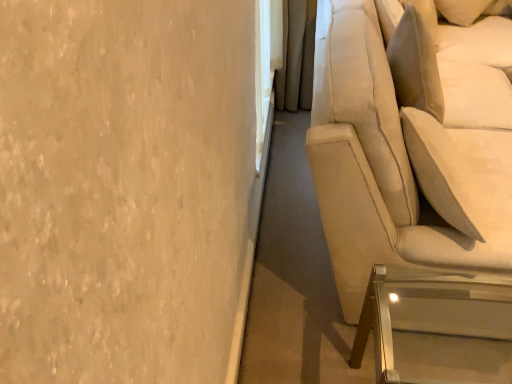
This screenshot has height=384, width=512. What do you see at coordinates (406, 151) in the screenshot?
I see `beige fabric couch at right` at bounding box center [406, 151].

I want to click on beige fabric couch at right, so click(x=406, y=151).

Measure the distance between point (334, 121) and camera.

They are 39.13 inches apart.

Describe the element at coordinates (429, 333) in the screenshot. This screenshot has height=384, width=512. I see `clear acrylic table at lower right` at that location.

I want to click on clear acrylic table at lower right, so click(429, 333).

At what (x,y) coordinates should I click in order to perform the action: click on beige fabric couch at right. Please return your answer as a coordinate pair (x, y). Looking at the image, I should click on (406, 151).

Can you confirm if clear acrylic table at lower right is positioned to the right of beige fabric couch at right?

No.

In the image, is clear acrylic table at lower right positioned in front of or behind beige fabric couch at right?

Visually, clear acrylic table at lower right is located behind beige fabric couch at right.

Considering the points (385, 342) and (466, 204), which point is in front, point (385, 342) or point (466, 204)?

Point (385, 342)

From the image's perspective, which one is positioned lower, clear acrylic table at lower right or beige fabric couch at right?

clear acrylic table at lower right appears lower in the image.

From a real-world perspective, between clear acrylic table at lower right and beige fabric couch at right, who is vertically lower?

clear acrylic table at lower right.

Which object is wider, clear acrylic table at lower right or beige fabric couch at right?

beige fabric couch at right.

Which of these two, clear acrylic table at lower right or beige fabric couch at right, stands shorter?

clear acrylic table at lower right.

Looking at this image, considering the relative sizes of clear acrylic table at lower right and beige fabric couch at right in the image provided, is clear acrylic table at lower right bigger than beige fabric couch at right?

Actually, clear acrylic table at lower right might be smaller than beige fabric couch at right.

Is clear acrylic table at lower right not within beige fabric couch at right?

Yes.

In the scene shown: Is there a large distance between clear acrylic table at lower right and beige fabric couch at right?

No, clear acrylic table at lower right is in close proximity to beige fabric couch at right.

Could you tell me if clear acrylic table at lower right is turned towards beige fabric couch at right?

No, clear acrylic table at lower right is not facing towards beige fabric couch at right.

Image resolution: width=512 pixels, height=384 pixels. Identify the location of furniture below the beige fabric couch at right (from a real-world perspective). (429, 333).

Which object is positioned more to the left, beige fabric couch at right or clear acrylic table at lower right?

clear acrylic table at lower right is more to the left.

Between beige fabric couch at right and clear acrylic table at lower right, which one is positioned in front?

beige fabric couch at right.

Is point (487, 133) more distant than point (373, 302)?

Yes, point (487, 133) is farther from viewer.

From the image's perspective, which is below, beige fabric couch at right or clear acrylic table at lower right?

From the image's view, clear acrylic table at lower right is below.

From a real-world perspective, who is located lower, beige fabric couch at right or clear acrylic table at lower right?

clear acrylic table at lower right is physically lower.

Which of these two, beige fabric couch at right or clear acrylic table at lower right, is wider?

With larger width is beige fabric couch at right.

Which of these two, beige fabric couch at right or clear acrylic table at lower right, stands taller?

Standing taller between the two is beige fabric couch at right.

Who is smaller, beige fabric couch at right or clear acrylic table at lower right?

clear acrylic table at lower right is smaller.

Do you think beige fabric couch at right is within clear acrylic table at lower right, or outside of it?

The correct answer is: outside.

Is the surface of beige fabric couch at right in direct contact with clear acrylic table at lower right?

beige fabric couch at right is not next to clear acrylic table at lower right, and they're not touching.

Consider the image. Could you tell me if beige fabric couch at right is facing clear acrylic table at lower right?

No, beige fabric couch at right does not turn towards clear acrylic table at lower right.

Can you tell me how much beige fabric couch at right and clear acrylic table at lower right differ in facing direction?

There is a 0.457-degree angle between the facing directions of beige fabric couch at right and clear acrylic table at lower right.

Where is `studio couch above the clear acrylic table at lower right (from a real-world perspective)`? Image resolution: width=512 pixels, height=384 pixels. studio couch above the clear acrylic table at lower right (from a real-world perspective) is located at coordinates (406, 151).

Where is `studio couch above the clear acrylic table at lower right (from the image's perspective)`? studio couch above the clear acrylic table at lower right (from the image's perspective) is located at coordinates (406, 151).

Find the location of a particular element. The width and height of the screenshot is (512, 384). furniture below the beige fabric couch at right (from the image's perspective) is located at coordinates (429, 333).